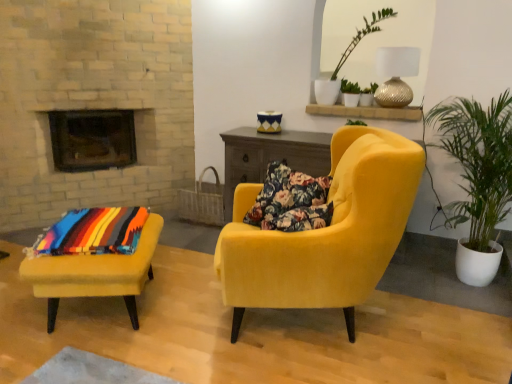
Question: From a real-world perspective, is green leafy plant at upper center physically below green leafy plant in white pot at right?

Choices:
 (A) yes
 (B) no

Answer: (B)

Question: Does green leafy plant at upper center appear on the left side of green leafy plant in white pot at right?

Choices:
 (A) no
 (B) yes

Answer: (B)

Question: Does green leafy plant at upper center lie behind green leafy plant in white pot at right?

Choices:
 (A) yes
 (B) no

Answer: (A)

Question: Is green leafy plant at upper center closer to the viewer compared to green leafy plant in white pot at right?

Choices:
 (A) yes
 (B) no

Answer: (B)

Question: From the image's perspective, does green leafy plant at upper center appear higher than green leafy plant in white pot at right?

Choices:
 (A) yes
 (B) no

Answer: (A)

Question: Based on their sizes in the image, would you say multicolored woven blanket at lower left is bigger or smaller than velvet yellow armchair at center, which ranks as the first chair in right-to-left order?

Choices:
 (A) big
 (B) small

Answer: (B)

Question: From the image's perspective, is multicolored woven blanket at lower left located above or below velvet yellow armchair at center, which ranks as the first chair in right-to-left order?

Choices:
 (A) below
 (B) above

Answer: (A)

Question: Is multicolored woven blanket at lower left wider or thinner than velvet yellow armchair at center, which ranks as the first chair in right-to-left order?

Choices:
 (A) wide
 (B) thin

Answer: (B)

Question: From a real-world perspective, is multicolored woven blanket at lower left physically located above or below velvet yellow armchair at center, which ranks as the first chair in right-to-left order?

Choices:
 (A) above
 (B) below

Answer: (B)

Question: Considering the positions of green leafy plant at upper center and velvet yellow ottoman at lower left, which is the 1th chair in left-to-right order, in the image, is green leafy plant at upper center taller or shorter than velvet yellow ottoman at lower left, which is the 1th chair in left-to-right order,?

Choices:
 (A) short
 (B) tall

Answer: (B)

Question: In the image, is green leafy plant at upper center positioned in front of or behind velvet yellow ottoman at lower left, which is the 1th chair in left-to-right order?

Choices:
 (A) front
 (B) behind

Answer: (B)

Question: From a real-world perspective, is green leafy plant at upper center positioned above or below velvet yellow ottoman at lower left, which is the 2th chair in right-to-left order?

Choices:
 (A) below
 (B) above

Answer: (B)

Question: Is point (382, 18) closer or farther from the camera than point (156, 233)?

Choices:
 (A) farther
 (B) closer

Answer: (A)

Question: Considering the positions of green leafy plant in white pot at right and green leafy plant at upper center in the image, is green leafy plant in white pot at right taller or shorter than green leafy plant at upper center?

Choices:
 (A) short
 (B) tall

Answer: (B)

Question: Is green leafy plant in white pot at right wider or thinner than green leafy plant at upper center?

Choices:
 (A) wide
 (B) thin

Answer: (A)